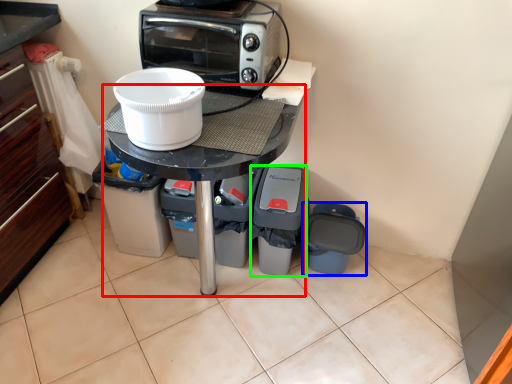
Question: Which is nearer to the table (highlighted by a red box)? appliance (highlighted by a blue box) or appliance (highlighted by a green box).

Choices:
 (A) appliance
 (B) appliance

Answer: (B)